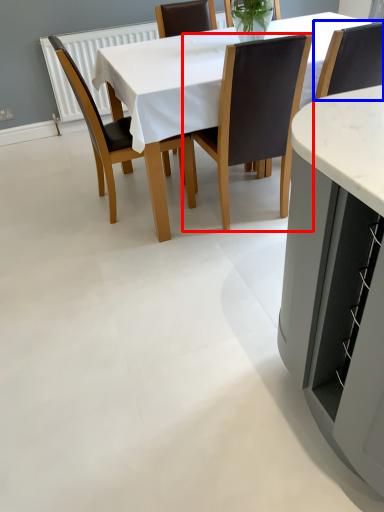
Question: Which of the following is the farthest to the observer, chair (highlighted by a red box) or chair (highlighted by a blue box)?

Choices:
 (A) chair
 (B) chair

Answer: (B)